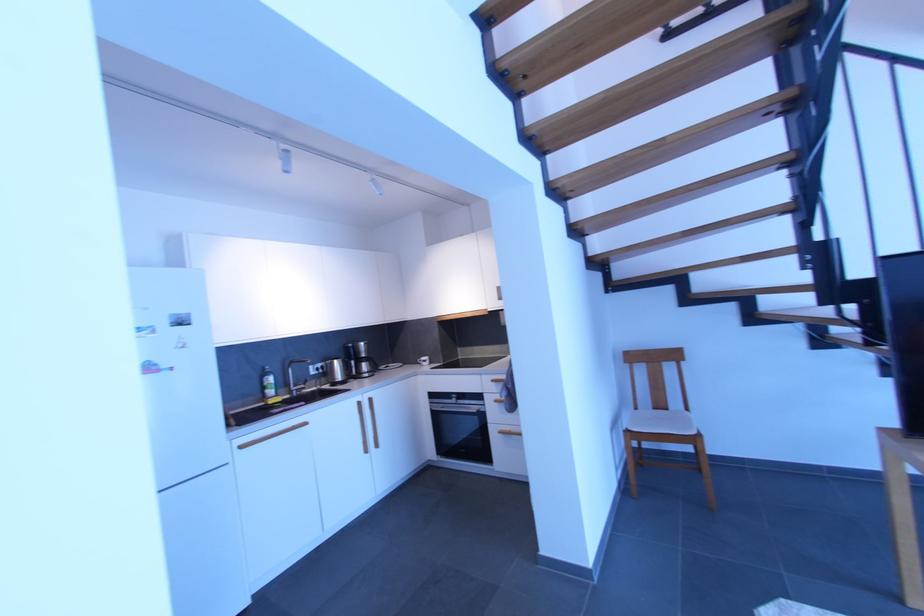
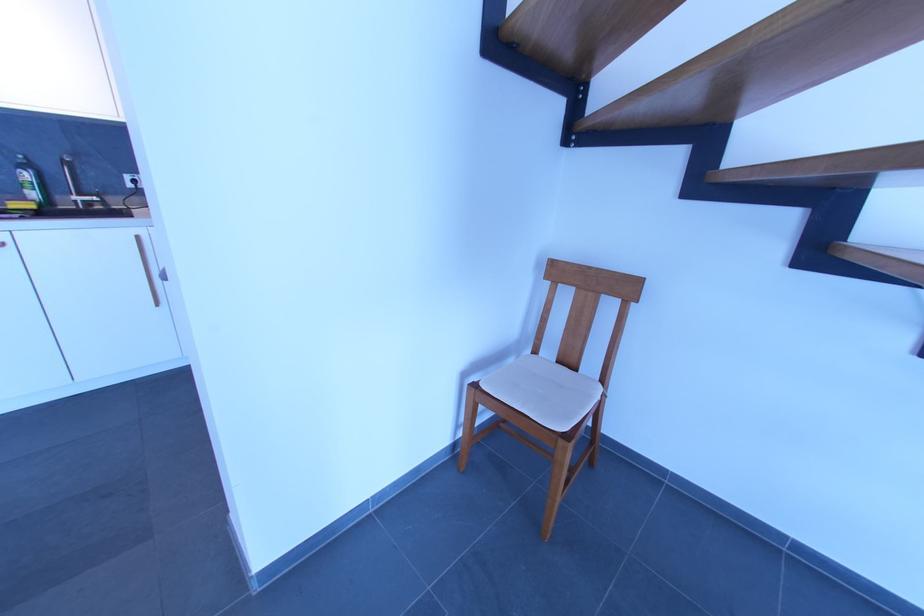
The point at (x=363, y=406) is marked in the first image. Where is the corresponding point in the second image?

(142, 241)